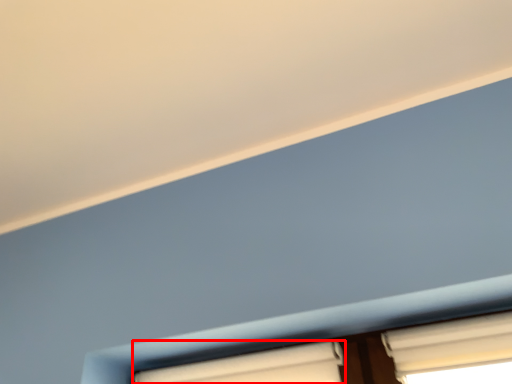
Question: Where is window (annotated by the red box) located in relation to window in the image?

Choices:
 (A) right
 (B) left

Answer: (B)